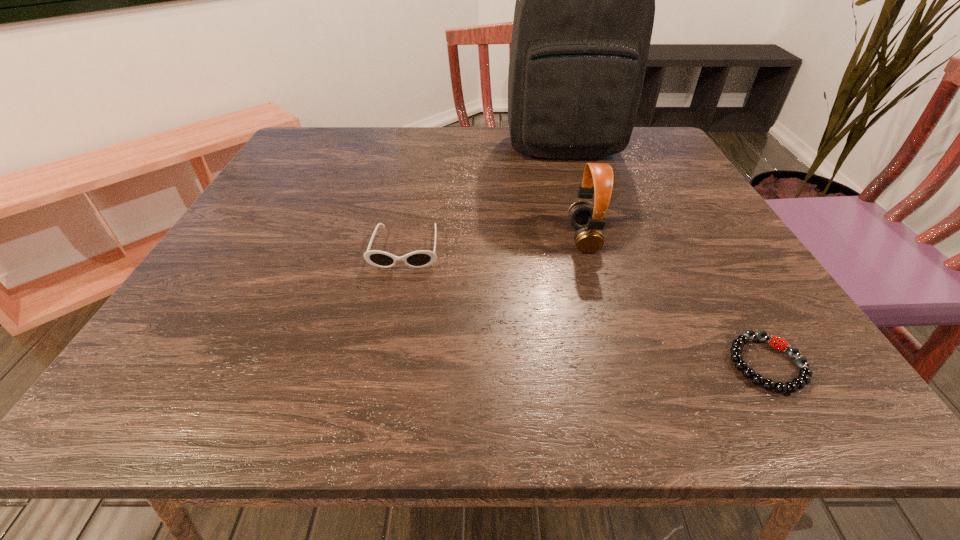
Where is `unoccupied position between the sunglasses and the shortest object`? This screenshot has width=960, height=540. unoccupied position between the sunglasses and the shortest object is located at coordinates (587, 306).

You are a GUI agent. You are given a task and a screenshot of the screen. Output one action in this format:
    pyautogui.click(x=<x>, y=<y>)
    Task: Click on the free space between the headset and the backpack
    Image resolution: width=960 pixels, height=540 pixels.
    Given the screenshot: What is the action you would take?
    pyautogui.click(x=573, y=192)

Where is `vacant area that lies between the headset and the second shortest object`? Image resolution: width=960 pixels, height=540 pixels. vacant area that lies between the headset and the second shortest object is located at coordinates coord(494,243).

This screenshot has height=540, width=960. In order to click on free space between the leftmost object and the tallest object in this screenshot , I will do `click(484, 197)`.

You are a GUI agent. You are given a task and a screenshot of the screen. Output one action in this format:
    pyautogui.click(x=<x>, y=<y>)
    Task: Click on the free space between the headset and the farthest object
    
    Given the screenshot: What is the action you would take?
    pyautogui.click(x=573, y=192)

Locate which object is the closest to the leftmost object. Please provide its 2D coordinates. Your answer should be formatted as a tuple, i.e. [(x, y)], where the tuple contains the x and y coordinates of a point satisfying the conditions above.

[(589, 222)]

Select which object is the closest to the third shortest object. Please provide its 2D coordinates. Your answer should be formatted as a tuple, i.e. [(x, y)], where the tuple contains the x and y coordinates of a point satisfying the conditions above.

[(585, 0)]

Locate an element on the screen. The width and height of the screenshot is (960, 540). vacant space that satisfies the following two spatial constraints: 1. with the lenses of the shortest object facing outward; 2. on the left side of the leftmost object is located at coordinates (382, 364).

The image size is (960, 540). Identify the location of blank space that satisfies the following two spatial constraints: 1. on the ear cups of the third shortest object; 2. with the lenses of the sunglasses facing outward. [587, 248].

Identify the location of vacant area that satisfies the following two spatial constraints: 1. on the ear cups of the second tallest object; 2. with the lenses of the leftmost object facing outward. (587, 248).